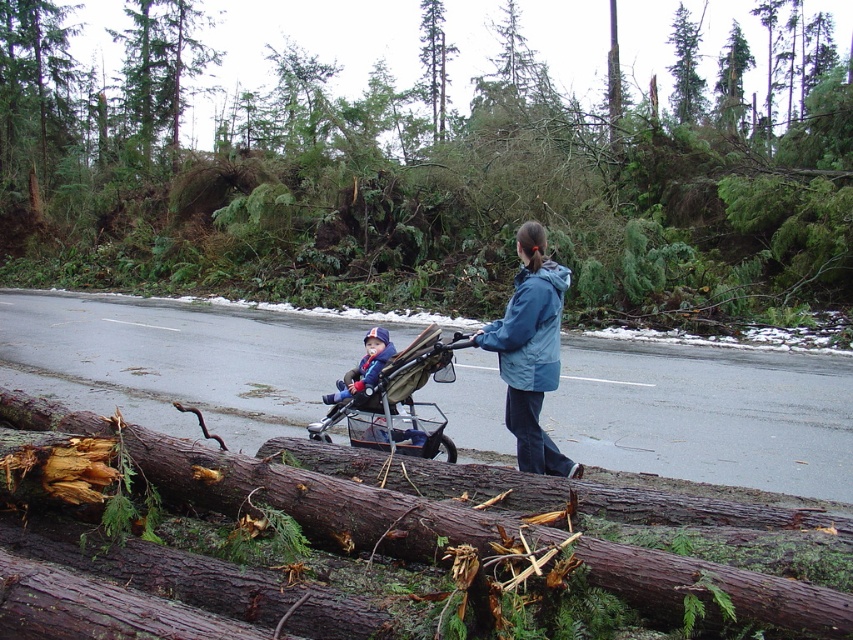
Measure the distance between dark brown wood at center and blue fabric jacket at center.

dark brown wood at center and blue fabric jacket at center are 2.23 meters apart.

Is point (146, 476) farther from viewer compared to point (531, 369)?

No, (146, 476) is in front of (531, 369).

The image size is (853, 640). Identify the location of dark brown wood at center. (310, 499).

Can you confirm if brown fabric stroller at center is taller than green textured tree at center?

Incorrect, brown fabric stroller at center's height is not larger of green textured tree at center's.

Can you confirm if brown fabric stroller at center is positioned to the left of green textured tree at center?

Correct, you'll find brown fabric stroller at center to the left of green textured tree at center.

Is point (357, 428) in front of point (427, 68)?

Yes, point (357, 428) is closer to viewer.

You are a GUI agent. You are given a task and a screenshot of the screen. Output one action in this format:
    pyautogui.click(x=<x>, y=<y>)
    Task: Click on the brown fabric stroller at center
    
    Given the screenshot: What is the action you would take?
    pyautogui.click(x=396, y=401)

Is blue smooth jacket at center above green textured tree at center?

→ Incorrect, blue smooth jacket at center is not positioned above green textured tree at center.

Is blue smooth jacket at center below green textured tree at center?

Yes.

Between point (554, 388) and point (442, 74), which one is positioned in front?

Positioned in front is point (554, 388).

Locate an element on the screen. The width and height of the screenshot is (853, 640). blue smooth jacket at center is located at coordinates (529, 330).